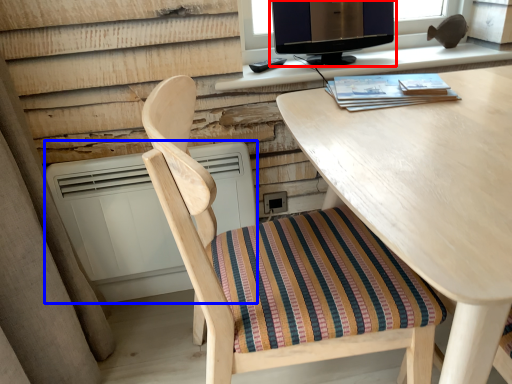
Question: Among these objects, which one is farthest to the camera, computer monitor (highlighted by a red box) or air conditioner (highlighted by a blue box)?

Choices:
 (A) computer monitor
 (B) air conditioner

Answer: (A)